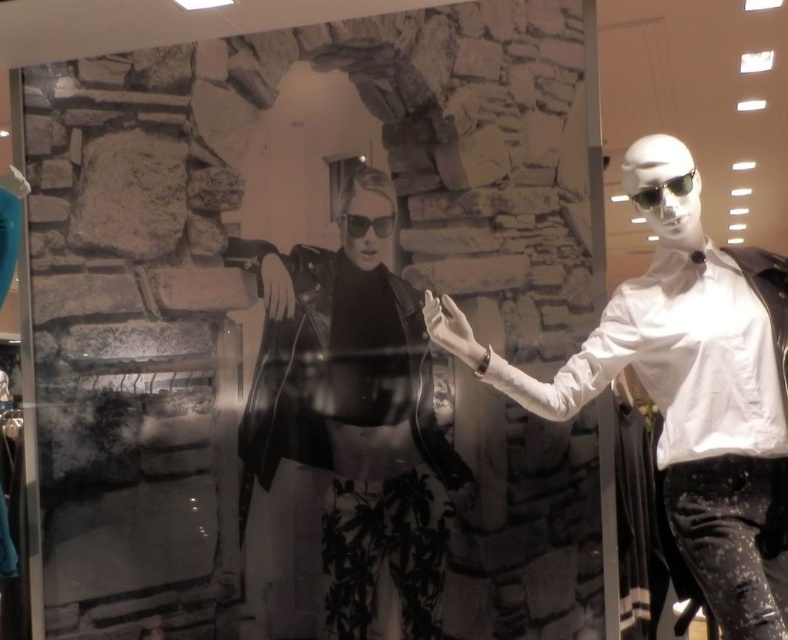
From the picture: Between white matte shirt at right and black matte sunglasses at center, which one appears on the right side from the viewer's perspective?

white matte shirt at right is more to the right.

Find the location of a particular element. Image resolution: width=788 pixels, height=640 pixels. white matte shirt at right is located at coordinates (686, 406).

You are a GUI agent. You are given a task and a screenshot of the screen. Output one action in this format:
    pyautogui.click(x=<x>, y=<y>)
    Task: Click on the white matte shirt at right
    Image resolution: width=788 pixels, height=640 pixels.
    Given the screenshot: What is the action you would take?
    (x=686, y=406)

In the scene shown: Which of these two, black leather jacket at center or white matte shirt at right, stands taller?

With more height is black leather jacket at center.

Between black leather jacket at center and white matte shirt at right, which one appears on the left side from the viewer's perspective?

From the viewer's perspective, black leather jacket at center appears more on the left side.

Locate an element on the screen. The image size is (788, 640). black leather jacket at center is located at coordinates (350, 442).

Identify the location of black leather jacket at center. [x=350, y=442].

Is the position of black matte sunglasses at right less distant than that of black matte sunglasses at center?

Yes, black matte sunglasses at right is in front of black matte sunglasses at center.

Between point (675, 188) and point (348, 230), which one is positioned behind?

The point (348, 230) is more distant.

Describe the element at coordinates (663, 189) in the screenshot. I see `black matte sunglasses at right` at that location.

In order to click on black matte sunglasses at right in this screenshot , I will do pos(663,189).